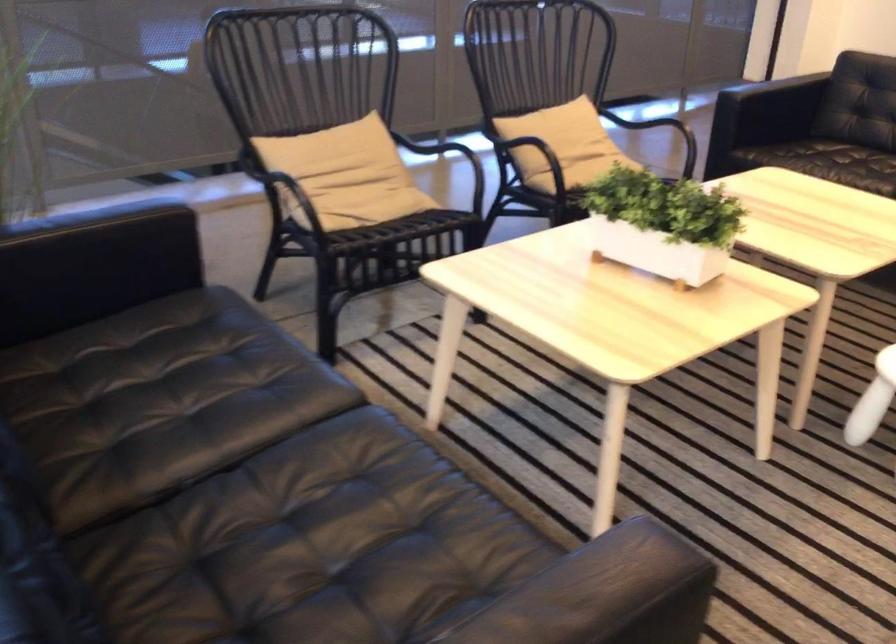
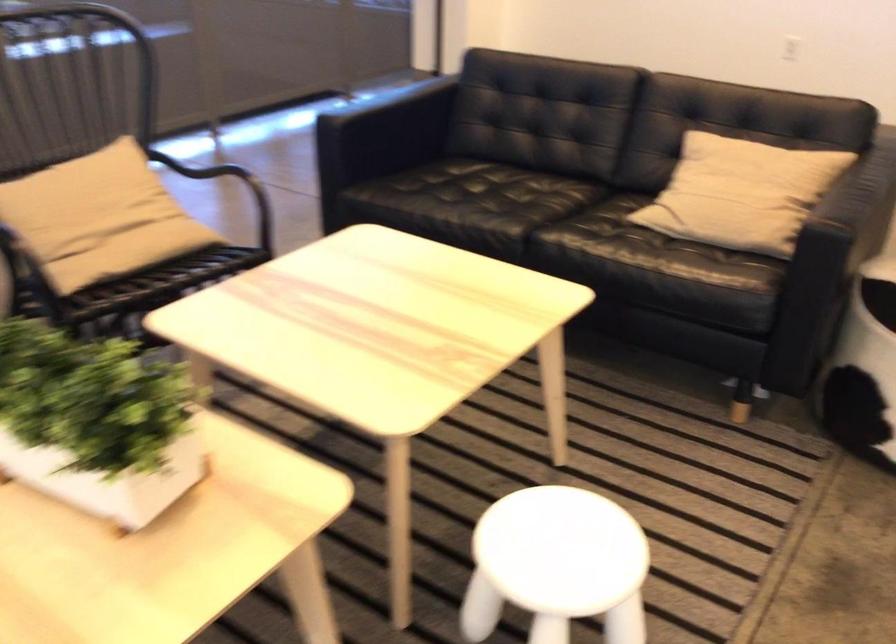
The point at (464, 194) is marked in the first image. Where is the corresponding point in the second image?

(9, 288)